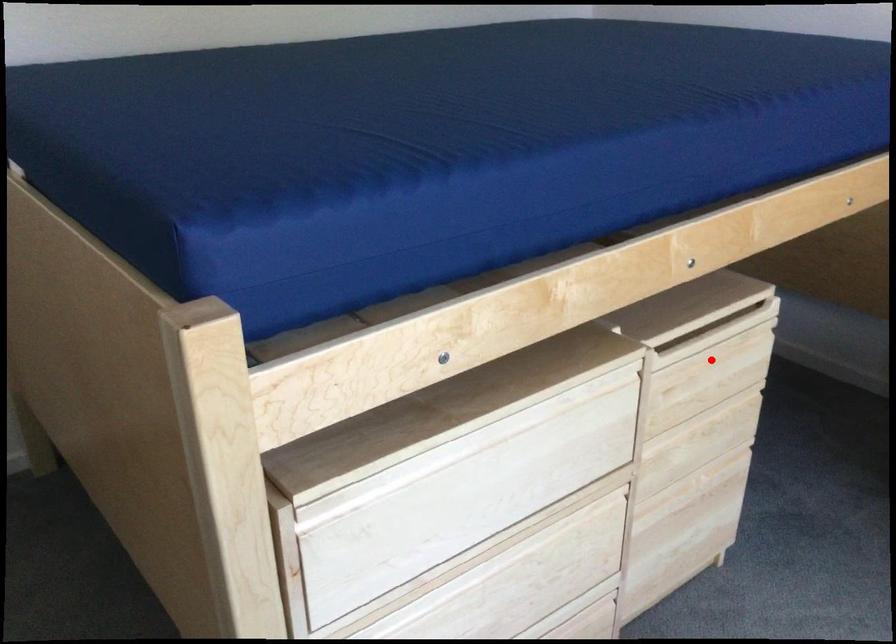
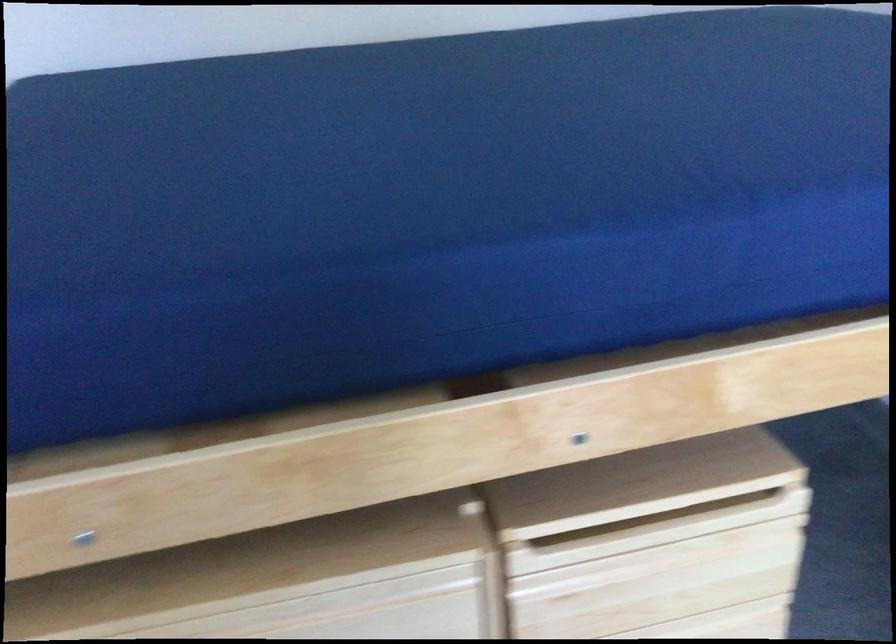
Locate, in the second image, the point that corresponds to the highlighted location in the first image.

(668, 559)